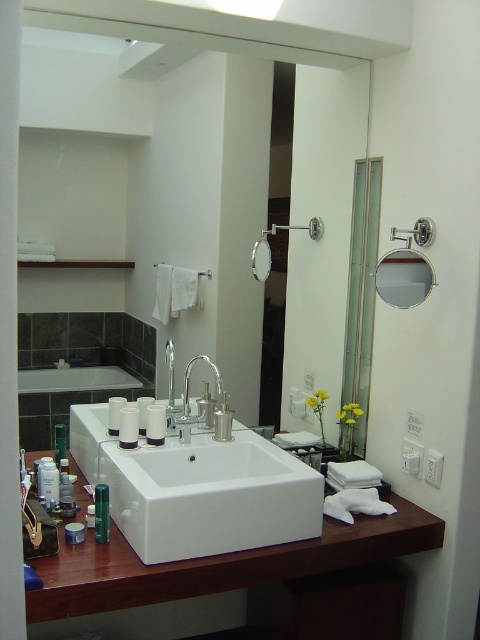
Question: Which point appears farthest from the camera in this image?

Choices:
 (A) (216, 433)
 (B) (230, 490)
 (C) (92, 509)

Answer: (A)

Question: Is matte silver mirror at upper right behind satin nickel faucet at center?

Choices:
 (A) no
 (B) yes

Answer: (A)

Question: Which of the following is the closest to the observer?

Choices:
 (A) green matte tube at center
 (B) matte silver mirror at upper right

Answer: (A)

Question: Which is nearer to the white ceramic sink at center?

Choices:
 (A) green plastic bottle at lower left
 (B) matte silver mirror at upper right
 (C) white glossy countertop at center
 (D) satin nickel faucet at center

Answer: (C)

Question: Can you confirm if white glossy countertop at center is bigger than green matte tube at center?

Choices:
 (A) no
 (B) yes

Answer: (B)

Question: Does white glossy countertop at center have a larger size compared to satin nickel faucet at center?

Choices:
 (A) no
 (B) yes

Answer: (B)